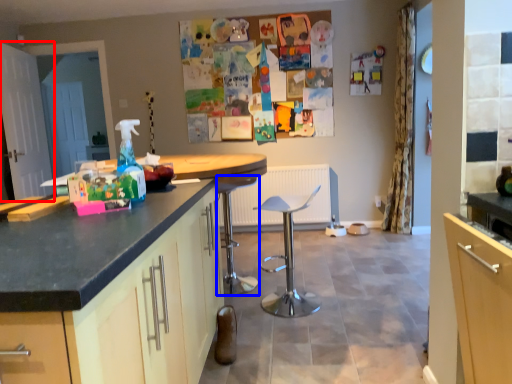
Question: Among these objects, which one is nearest to the camera, screen door (highlighted by a red box) or bar stool (highlighted by a blue box)?

Choices:
 (A) screen door
 (B) bar stool

Answer: (B)